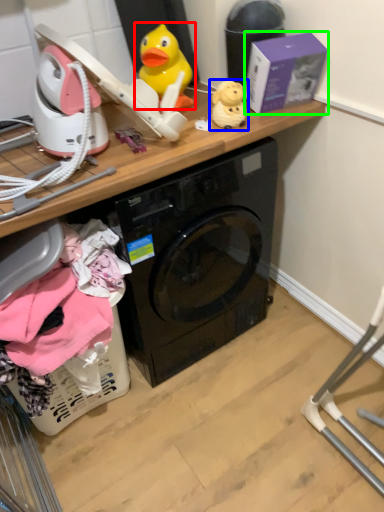
Question: Which object is the farthest from toy (highlighted by a red box)? Choose among these: toy (highlighted by a blue box) or box (highlighted by a green box).

Choices:
 (A) toy
 (B) box

Answer: (B)